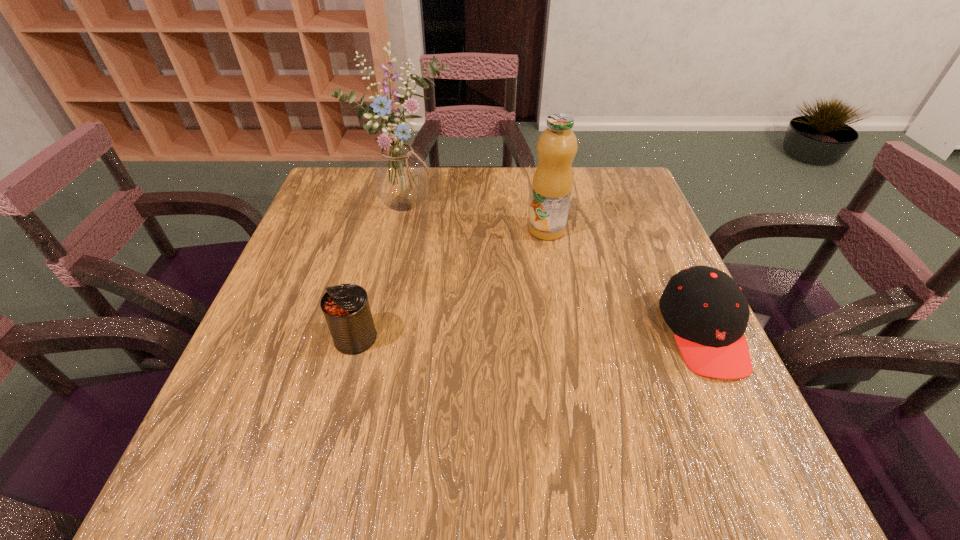
Locate an element on the screen. blank space at the left edge of the desktop is located at coordinates (306, 376).

I want to click on vacant space at the right edge, so (626, 293).

This screenshot has height=540, width=960. I want to click on free space at the far left corner of the desktop, so click(348, 211).

Where is `free spot at the near left corner of the desktop`? This screenshot has width=960, height=540. free spot at the near left corner of the desktop is located at coordinates (262, 389).

The width and height of the screenshot is (960, 540). What are the coordinates of `vacant position at the far right corner of the desktop` in the screenshot? It's located at (620, 210).

This screenshot has height=540, width=960. I want to click on free area in between the third object from left to right and the bouquet, so click(x=476, y=218).

Find the location of a particular element. The width and height of the screenshot is (960, 540). unoccupied position between the third tallest object and the bouquet is located at coordinates (381, 272).

Find the location of a particular element. The width and height of the screenshot is (960, 540). unoccupied area between the can and the shortest object is located at coordinates (529, 335).

The height and width of the screenshot is (540, 960). In order to click on free spot between the can and the tallest object in this screenshot , I will do `click(381, 272)`.

Where is `unoccupied position between the cap and the tallest object`? The height and width of the screenshot is (540, 960). unoccupied position between the cap and the tallest object is located at coordinates (555, 269).